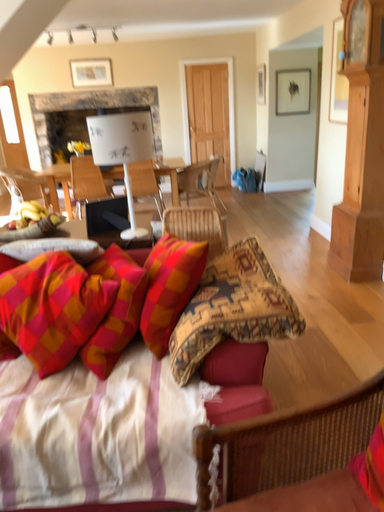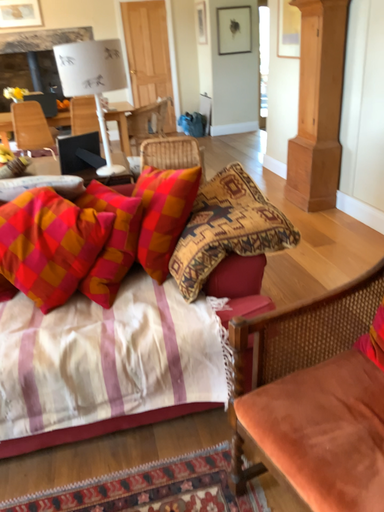
Question: Which way did the camera rotate in the video?

Choices:
 (A) rotated right
 (B) rotated left

Answer: (A)